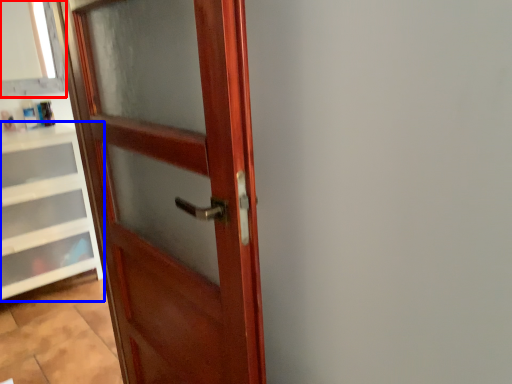
Question: Which point is closer to the camera, window frame (highlighted by a red box) or cabinetry (highlighted by a blue box)?

Choices:
 (A) window frame
 (B) cabinetry

Answer: (B)